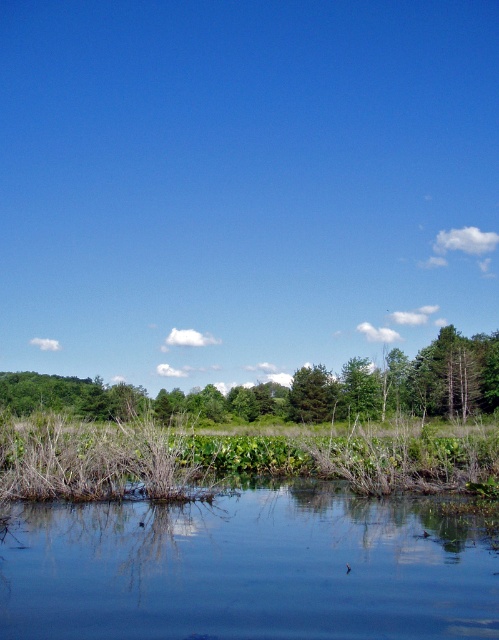
You are observing the serene natural landscape with the calm water and vegetation. There are two points marked in the image. The first point is at coordinates point [141,467] and the second is at point [297,388]. Which point is closer to you?

Point [141,467] is closer to the camera than point [297,388].

You are a boat operator who needs to navigate a 100 feet long vessel through the calm body of water. The clear water at lower center and the green leafy tree at center are landmarks in your path. Can your vessel pass between these two landmarks without touching either? Please explain.

The clear water at lower center and the green leafy tree at center are 118.41 feet apart. Since the vessel is 100 feet long, there is sufficient space between the two landmarks for the vessel to pass through without touching either.

You are standing at the edge of the water and see the green grassy reed at lower center and the green matte tree at center. Which object is closer to you?

The green grassy reed at lower center is closer to you because it is positioned in front of the green matte tree at center.